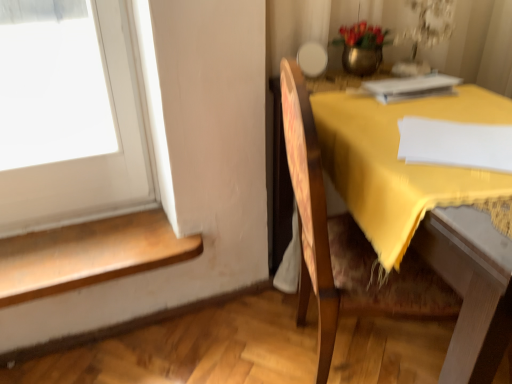
Question: Should I look upward or downward to see white paper at upper right?

Choices:
 (A) down
 (B) up

Answer: (B)

Question: From a real-world perspective, is metallic vase at upper center beneath yellow fabric at right?

Choices:
 (A) no
 (B) yes

Answer: (A)

Question: Does metallic vase at upper center come in front of yellow fabric at right?

Choices:
 (A) yes
 (B) no

Answer: (B)

Question: Are metallic vase at upper center and yellow fabric at right making contact?

Choices:
 (A) no
 (B) yes

Answer: (A)

Question: Is metallic vase at upper center completely or partially outside of yellow fabric at right?

Choices:
 (A) no
 (B) yes

Answer: (B)

Question: Does metallic vase at upper center have a lesser height compared to yellow fabric at right?

Choices:
 (A) yes
 (B) no

Answer: (A)

Question: Does metallic vase at upper center have a greater height compared to yellow fabric at right?

Choices:
 (A) yes
 (B) no

Answer: (B)

Question: Would you say white paper at upper right is outside metallic vase at upper center?

Choices:
 (A) no
 (B) yes

Answer: (B)

Question: From a real-world perspective, is white paper at upper right positioned under metallic vase at upper center based on gravity?

Choices:
 (A) yes
 (B) no

Answer: (A)

Question: Considering the relative sizes of white paper at upper right and metallic vase at upper center in the image provided, is white paper at upper right smaller than metallic vase at upper center?

Choices:
 (A) no
 (B) yes

Answer: (B)

Question: From a real-world perspective, is white paper at upper right physically above metallic vase at upper center?

Choices:
 (A) yes
 (B) no

Answer: (B)

Question: Considering the relative sizes of white paper at upper right and metallic vase at upper center in the image provided, is white paper at upper right taller than metallic vase at upper center?

Choices:
 (A) yes
 (B) no

Answer: (B)

Question: From the image's perspective, is white paper at upper right located above metallic vase at upper center?

Choices:
 (A) no
 (B) yes

Answer: (A)

Question: Is metallic vase at upper center oriented towards wooden chair at right?

Choices:
 (A) yes
 (B) no

Answer: (B)